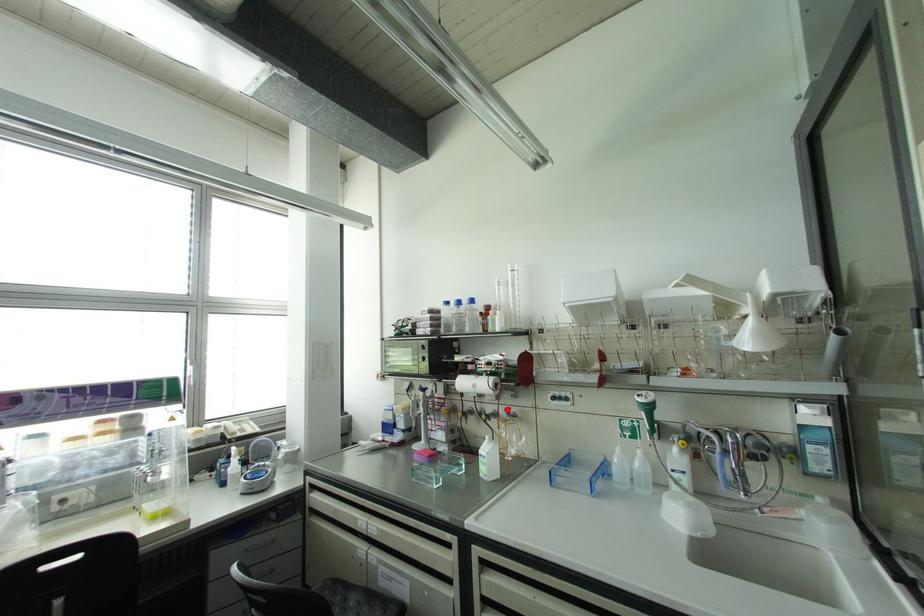
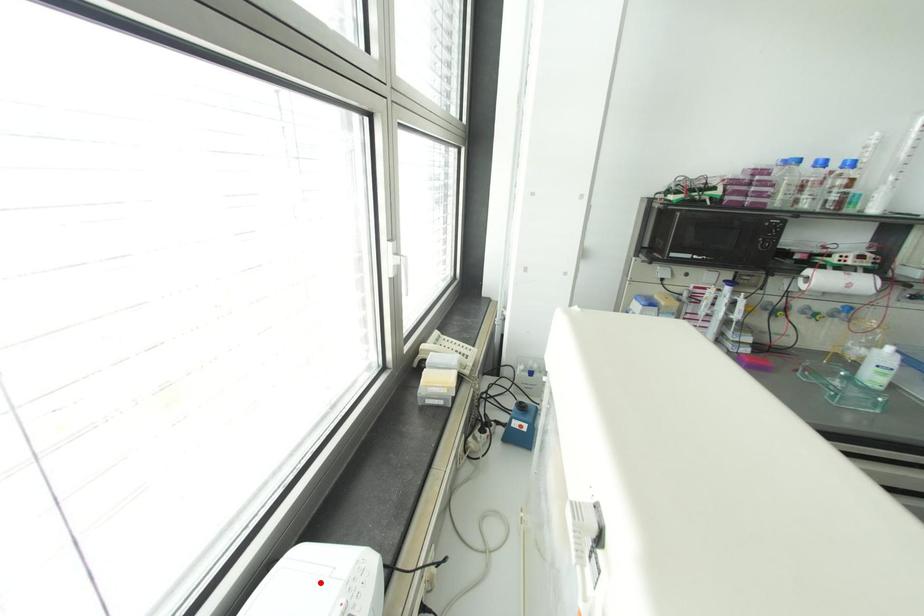
I am providing you with two images of the same scene from different viewpoints. A red point is marked on the first image and another point is marked on the second image. Is the marked point in image1 the same physical position as the marked point in image2?

No